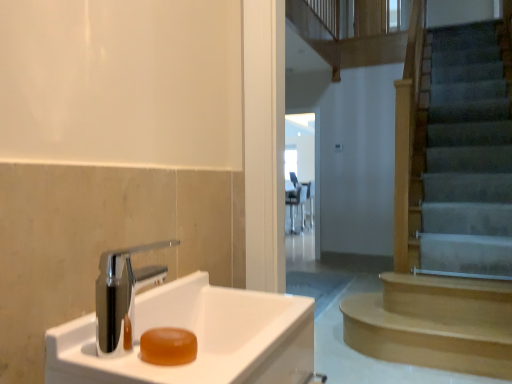
Question: Should I look upward or downward to see transparent glass door at center?

Choices:
 (A) up
 (B) down

Answer: (A)

Question: Does white glossy sink at lower left appear on the right side of transparent glass door at center?

Choices:
 (A) no
 (B) yes

Answer: (A)

Question: Considering the relative positions of white glossy sink at lower left and transparent glass door at center in the image provided, is white glossy sink at lower left to the left of transparent glass door at center from the viewer's perspective?

Choices:
 (A) no
 (B) yes

Answer: (B)

Question: Is white glossy sink at lower left taller than transparent glass door at center?

Choices:
 (A) no
 (B) yes

Answer: (A)

Question: From the image's perspective, does white glossy sink at lower left appear lower than transparent glass door at center?

Choices:
 (A) no
 (B) yes

Answer: (B)

Question: Does white glossy sink at lower left turn towards transparent glass door at center?

Choices:
 (A) no
 (B) yes

Answer: (A)

Question: Is white glossy sink at lower left shorter than transparent glass door at center?

Choices:
 (A) yes
 (B) no

Answer: (A)

Question: Is the position of light brown wooden stairs at right less distant than that of white glossy sink at lower left?

Choices:
 (A) no
 (B) yes

Answer: (A)

Question: Would you consider light brown wooden stairs at right to be distant from white glossy sink at lower left?

Choices:
 (A) no
 (B) yes

Answer: (B)

Question: Does light brown wooden stairs at right lie behind white glossy sink at lower left?

Choices:
 (A) no
 (B) yes

Answer: (B)

Question: Could white glossy sink at lower left be considered to be inside light brown wooden stairs at right?

Choices:
 (A) yes
 (B) no

Answer: (B)

Question: Does light brown wooden stairs at right have a lesser width compared to white glossy sink at lower left?

Choices:
 (A) no
 (B) yes

Answer: (A)

Question: Can you confirm if light brown wooden stairs at right is positioned to the right of white glossy sink at lower left?

Choices:
 (A) no
 (B) yes

Answer: (B)

Question: Is the position of translucent amber soap at sink left more distant than that of transparent glass door at center?

Choices:
 (A) no
 (B) yes

Answer: (A)